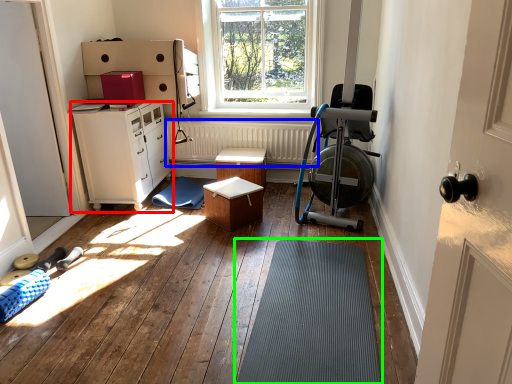
Question: Which is farther away from chest of drawers (highlighted by a red box)? radiator (highlighted by a blue box) or bath mat (highlighted by a green box)?

Choices:
 (A) radiator
 (B) bath mat

Answer: (B)